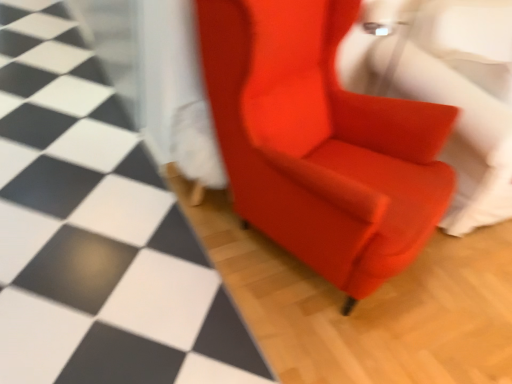
What do you see at coordinates (457, 91) in the screenshot?
I see `satin red armchair at center` at bounding box center [457, 91].

In order to click on satin red armchair at center in this screenshot , I will do `click(457, 91)`.

This screenshot has height=384, width=512. Identify the location of matte red armchair at center. (96, 232).

The height and width of the screenshot is (384, 512). Find the location of `satin red armchair at center`. satin red armchair at center is located at coordinates (320, 142).

Locate an element on the screen. satin red armchair at center is located at coordinates click(x=457, y=91).

Between matte red armchair at center and satin red armchair at center, which one has more height?

With more height is satin red armchair at center.

From the image's perspective, is matte red armchair at center above or below satin red armchair at center?

From the image's perspective, matte red armchair at center appears below satin red armchair at center.

How different are the orientations of matte red armchair at center and satin red armchair at center in degrees?

0.681 degrees.

In the scene shown: Who is smaller, satin red armchair at center or satin red armchair at center?

Smaller between the two is satin red armchair at center.

Is the depth of satin red armchair at center greater than that of satin red armchair at center?

That is True.

What's the angular difference between satin red armchair at center and satin red armchair at center's facing directions?

There is a 27.6-degree angle between the facing directions of satin red armchair at center and satin red armchair at center.

From a real-world perspective, which object rests below the other?

matte red armchair at center.

Is matte red armchair at center facing away from satin red armchair at center?

That's not correct — matte red armchair at center is not looking away from satin red armchair at center.

Is matte red armchair at center not close to satin red armchair at center?

matte red armchair at center is actually quite close to satin red armchair at center.

Between satin red armchair at center and matte red armchair at center, which one has less height?

With less height is matte red armchair at center.

From the image's perspective, which is above, satin red armchair at center or matte red armchair at center?

satin red armchair at center appears higher in the image.

Is satin red armchair at center looking in the opposite direction of matte red armchair at center?

That's not correct — satin red armchair at center is not looking away from matte red armchair at center.

Between satin red armchair at center and matte red armchair at center, which one has larger width?

Wider between the two is matte red armchair at center.

Which is closer to the camera, (x=313, y=215) or (x=492, y=197)?

Point (x=313, y=215).

The height and width of the screenshot is (384, 512). I want to click on swivel chair below the satin red armchair at center (from a real-world perspective), so click(x=457, y=91).

In the scene shown: From a real-world perspective, relative to satin red armchair at center, is satin red armchair at center vertically above or below?

satin red armchair at center is situated higher than satin red armchair at center in the real world.

Considering their positions, is satin red armchair at center located in front of or behind satin red armchair at center?

In the image, satin red armchair at center appears in front of satin red armchair at center.

From the image's perspective, which is above, satin red armchair at center or matte red armchair at center?

matte red armchair at center.

Do you think satin red armchair at center is within matte red armchair at center, or outside of it?

satin red armchair at center exists outside the volume of matte red armchair at center.

Does satin red armchair at center have a larger size compared to matte red armchair at center?

Yes, satin red armchair at center is bigger than matte red armchair at center.

Identify the location of swivel chair on the right of matte red armchair at center. (457, 91).

This screenshot has height=384, width=512. Identify the location of swivel chair lying above the satin red armchair at center (from the image's perspective). (457, 91).

Looking at the image, which one is located closer to matte red armchair at center, satin red armchair at center or satin red armchair at center?

satin red armchair at center.

From the image, which object appears to be farther from satin red armchair at center, matte red armchair at center or satin red armchair at center?

The object further to satin red armchair at center is matte red armchair at center.

Estimate the real-world distances between objects in this image. Which object is closer to satin red armchair at center, matte red armchair at center or satin red armchair at center?

satin red armchair at center lies closer to satin red armchair at center than the other object.

Based on their spatial positions, is satin red armchair at center or satin red armchair at center further from matte red armchair at center?

Among the two, satin red armchair at center is located further to matte red armchair at center.

When comparing their distances from satin red armchair at center, does satin red armchair at center or matte red armchair at center seem closer?

satin red armchair at center is closer to satin red armchair at center.

From the image, which object appears to be farther from satin red armchair at center, satin red armchair at center or matte red armchair at center?

Among the two, matte red armchair at center is located further to satin red armchair at center.

Find the location of `chair between matte red armchair at center and satin red armchair at center in the horizontal direction`. chair between matte red armchair at center and satin red armchair at center in the horizontal direction is located at coordinates (320, 142).